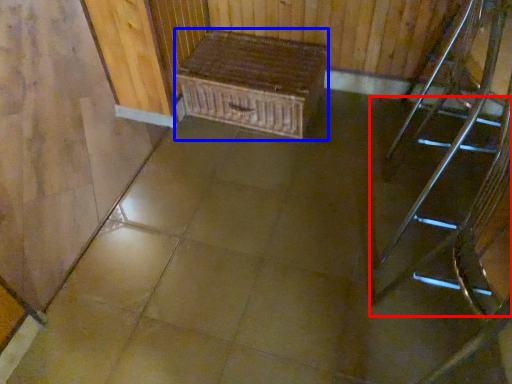
Question: Which object appears farthest to the camera in this image, stairs (highlighted by a red box) or furniture (highlighted by a blue box)?

Choices:
 (A) stairs
 (B) furniture

Answer: (B)